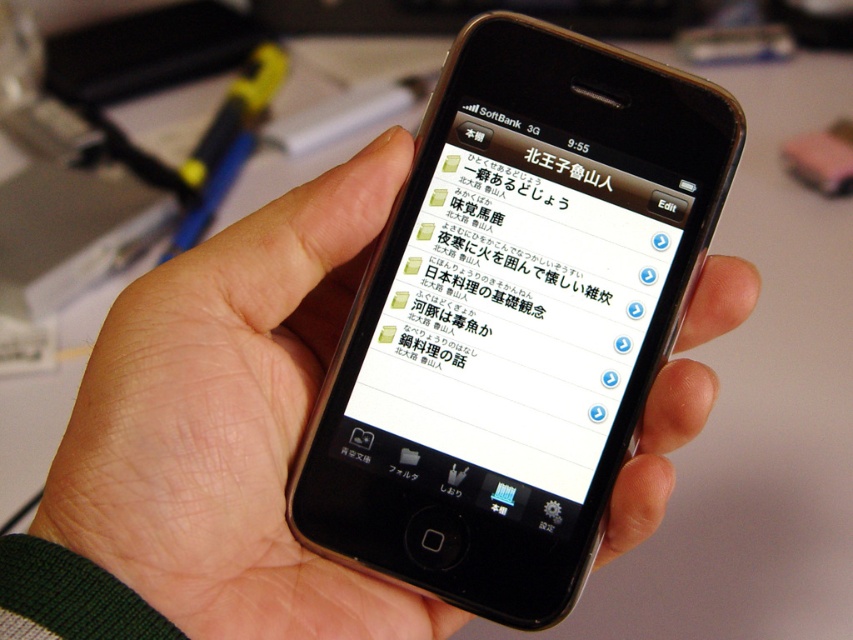
Question: Which object is farther from the camera taking this photo?

Choices:
 (A) black matte phone at center
 (B) white glossy text at center

Answer: (B)

Question: In this image, where is black matte phone at center located relative to white glossy text at center?

Choices:
 (A) right
 (B) left

Answer: (B)

Question: Is black matte phone at center wider than white glossy text at center?

Choices:
 (A) yes
 (B) no

Answer: (A)

Question: Can you confirm if black matte phone at center is positioned above white glossy text at center?

Choices:
 (A) yes
 (B) no

Answer: (B)

Question: Among these objects, which one is farthest from the camera?

Choices:
 (A) black matte phone at center
 (B) white glossy text at center

Answer: (B)